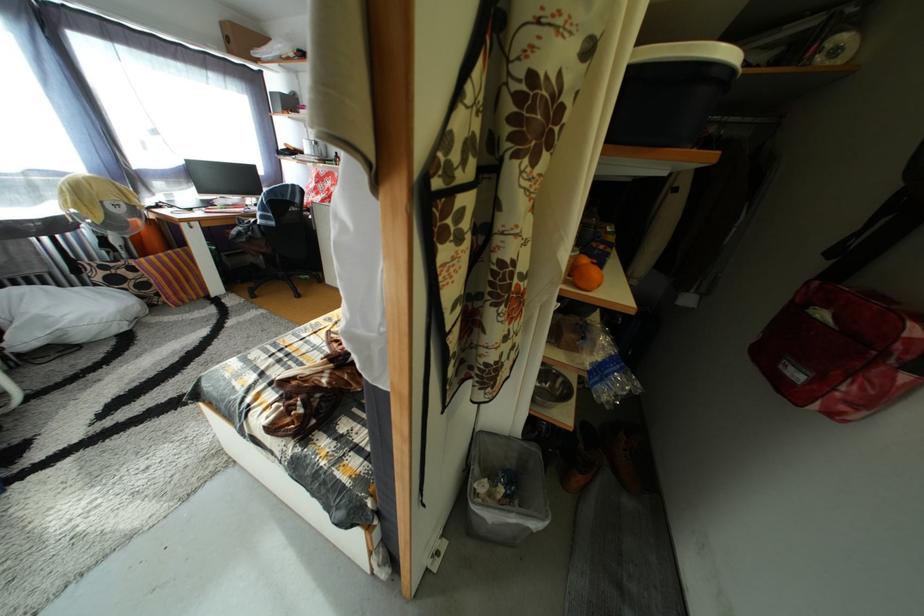
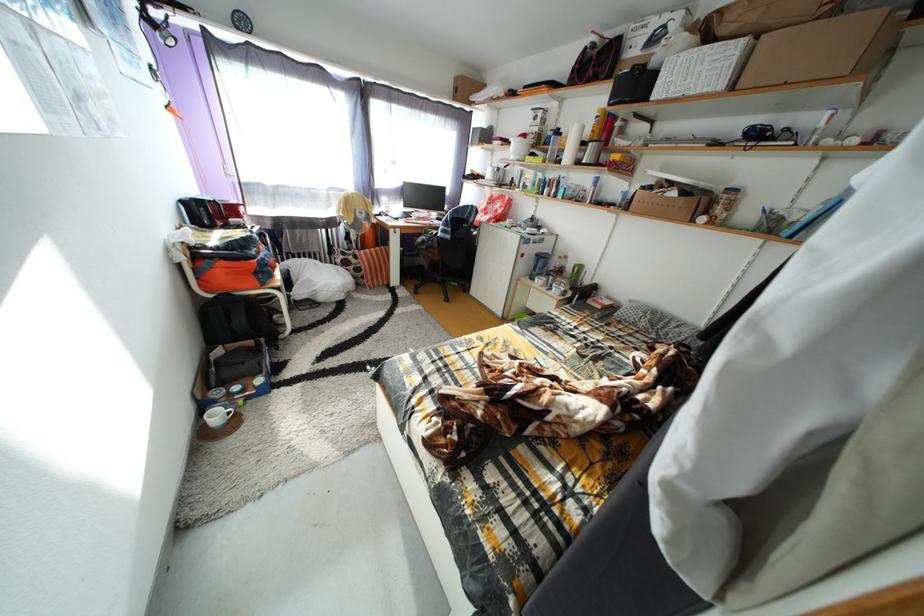
Question: The images are taken continuously from a first-person perspective. In which direction are you moving?

Choices:
 (A) Left
 (B) Right
 (C) Forward
 (D) Backward

Answer: (A)